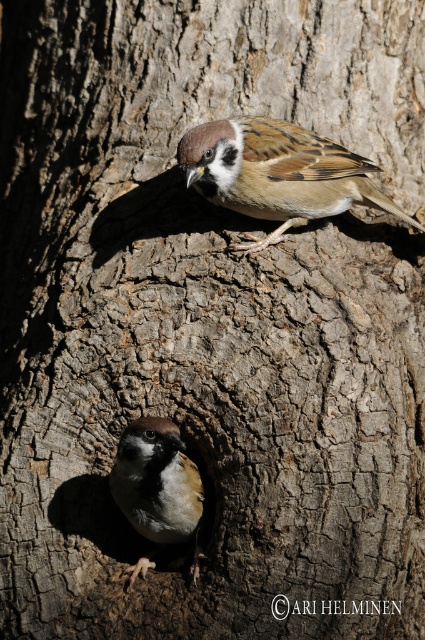
Is brown speckled sparrow at upper center to the right of brown feathered sparrow at lower left from the viewer's perspective?

Yes, brown speckled sparrow at upper center is to the right of brown feathered sparrow at lower left.

Does point (277, 160) come behind point (161, 444)?

Yes, point (277, 160) is behind point (161, 444).

Where is `brown speckled sparrow at upper center`? The width and height of the screenshot is (425, 640). brown speckled sparrow at upper center is located at coordinates (277, 173).